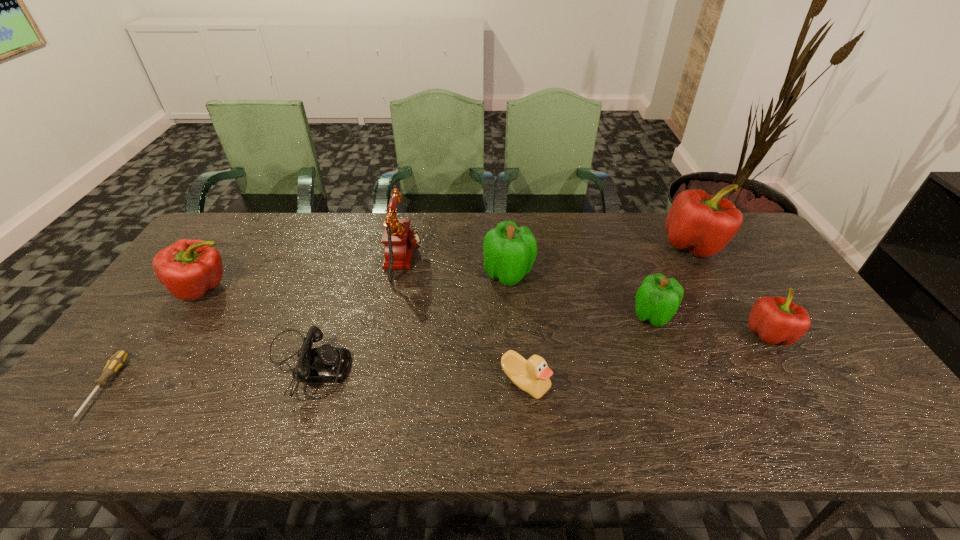
Where is `the farthest pink bell pepper`? The height and width of the screenshot is (540, 960). the farthest pink bell pepper is located at coordinates (703, 224).

Image resolution: width=960 pixels, height=540 pixels. What are the coordinates of `the fourth object from left to right` in the screenshot? It's located at 399,240.

Locate an element on the screen. the right telephone is located at coordinates (399, 240).

You are a GUI agent. You are given a task and a screenshot of the screen. Output one action in this format:
    pyautogui.click(x=<x>, y=<y>)
    Task: Click on the farther green bell pepper
    
    Given the screenshot: What is the action you would take?
    pyautogui.click(x=509, y=251)

Locate an element on the screen. the bigger green bell pepper is located at coordinates (509, 251).

Identify the location of the second biggest pink bell pepper. (188, 268).

The width and height of the screenshot is (960, 540). In order to click on the second nearest pink bell pepper in this screenshot , I will do `click(188, 268)`.

Find the location of `the right green bell pepper`. the right green bell pepper is located at coordinates (657, 300).

Identify the location of the smaller green bell pepper. This screenshot has width=960, height=540. (657, 300).

The height and width of the screenshot is (540, 960). In order to click on the smallest pink bell pepper in this screenshot , I will do `click(776, 320)`.